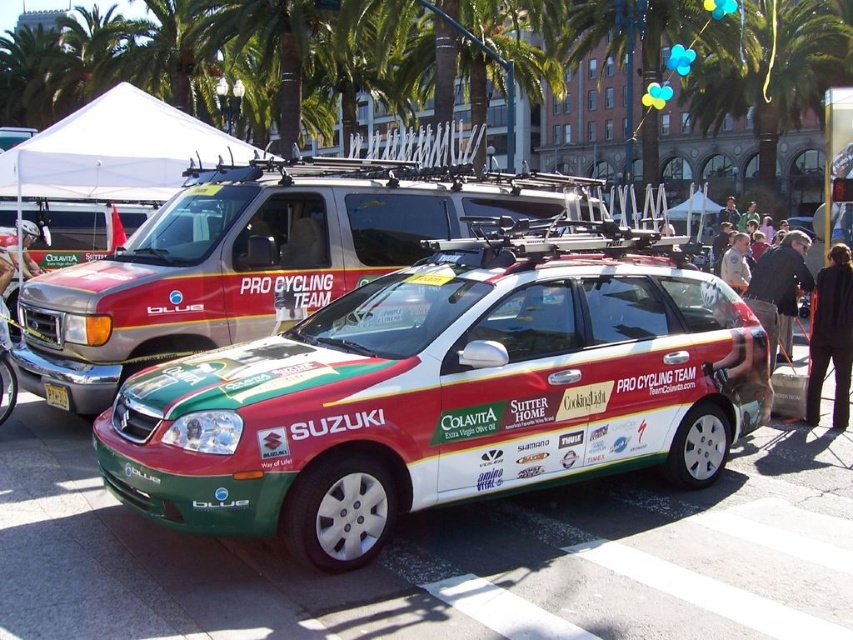
Question: Which of the following is the closest to the observer?

Choices:
 (A) (250, 227)
 (B) (838, 16)
 (C) (248, 413)
 (D) (831, 307)

Answer: (C)

Question: Among these objects, which one is nearest to the camera?

Choices:
 (A) black fabric pants at lower right
 (B) green matte car at center
 (C) green matte suzuki car at center

Answer: (C)

Question: Which object is farther from the camera taking this photo?

Choices:
 (A) green matte suzuki car at center
 (B) matte black helmet at left

Answer: (B)

Question: Is green leafy palm tree at upper center smaller than light brown leather jacket at upper right?

Choices:
 (A) no
 (B) yes

Answer: (A)

Question: Is white fabric canopy at upper center smaller than black fabric pants at lower right?

Choices:
 (A) yes
 (B) no

Answer: (B)

Question: Is green matte car at center wider than white fabric canopy at upper center?

Choices:
 (A) no
 (B) yes

Answer: (A)